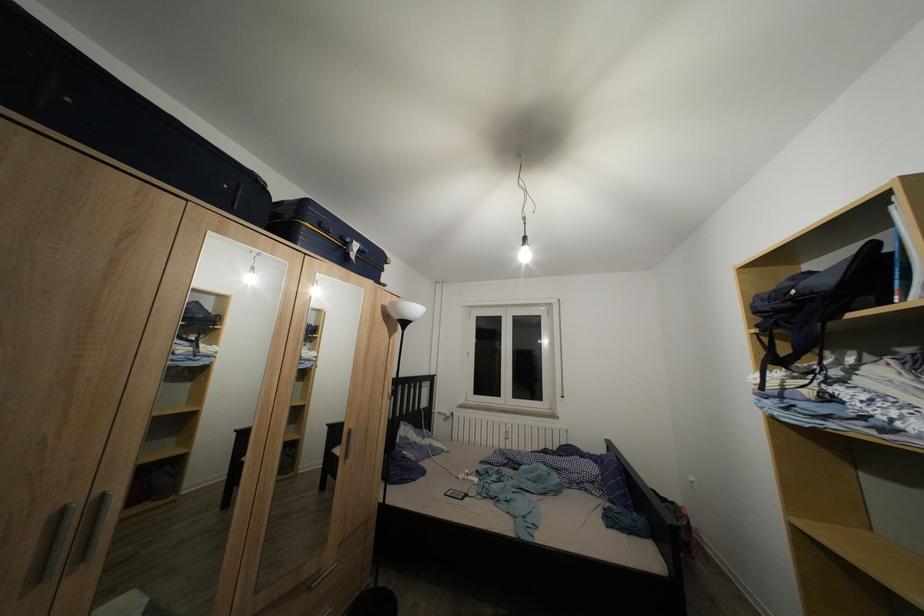
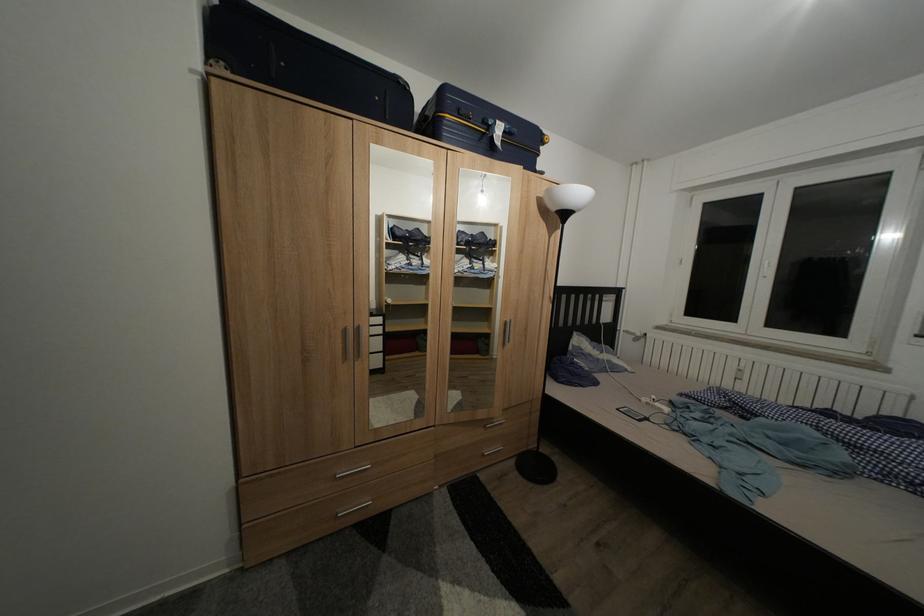
How did the camera likely rotate?

The rotation direction of the camera is left-down.